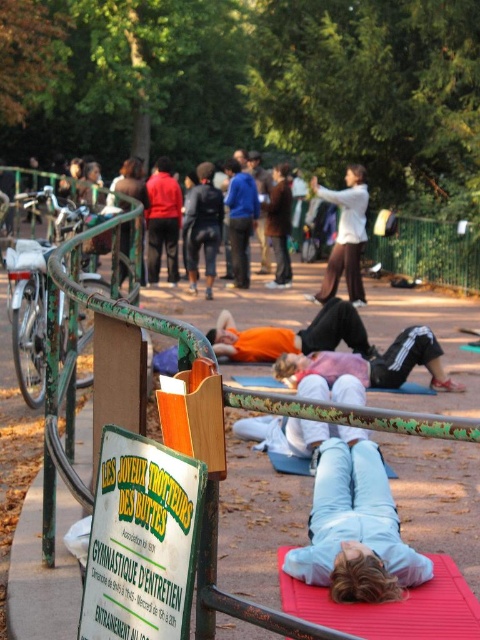
Question: Can you confirm if green paper sign at lower left is thinner than dark blue jacket at center?

Choices:
 (A) no
 (B) yes

Answer: (B)

Question: Which of the following is the closest to the observer?

Choices:
 (A) (383, 632)
 (B) (193, 500)
 (C) (292, 620)
 (D) (334, 291)

Answer: (C)

Question: Can you confirm if dark blue jacket at center is positioned below red matte jacket at center?

Choices:
 (A) yes
 (B) no

Answer: (A)

Question: Based on their relative distances, which object is nearer to the red matte jacket at center?

Choices:
 (A) green paper sign at lower left
 (B) red rubber yoga mat at lower center
 (C) dark blue jacket at center
 (D) green painted metal rail at center

Answer: (C)

Question: Which object is the closest to the red rubber yoga mat at lower center?

Choices:
 (A) green paper sign at lower left
 (B) red matte jacket at center

Answer: (A)

Question: Is white matte jacket at center to the right of dark blue jacket at center from the viewer's perspective?

Choices:
 (A) yes
 (B) no

Answer: (A)